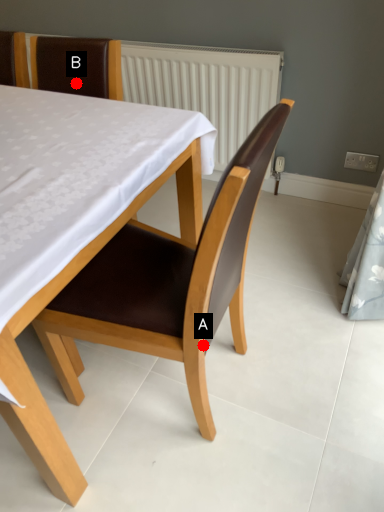
Question: Two points are circled on the image, labeled by A and B beside each circle. Among these points, which one is nearest to the camera?

Choices:
 (A) A is closer
 (B) B is closer

Answer: (A)